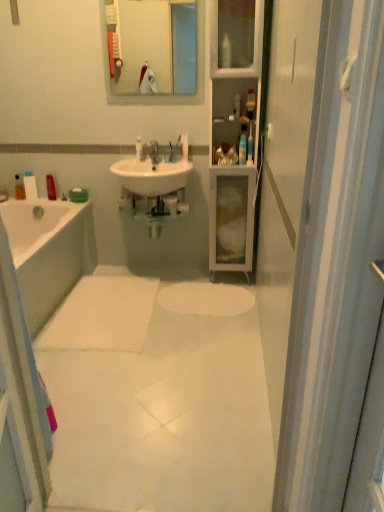
I want to click on vacant space situated above white smooth mat at center (from a real-world perspective), so click(x=146, y=347).